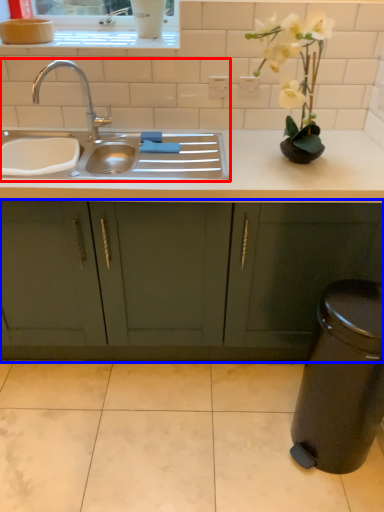
Question: Which point is closer to the camera, sink (highlighted by a red box) or cabinetry (highlighted by a blue box)?

Choices:
 (A) sink
 (B) cabinetry

Answer: (A)